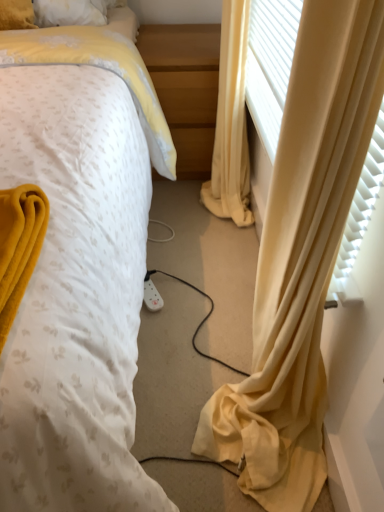
Question: From the image's perspective, does yellow fabric curtain at right appear higher than light wood/finely finished nightstand at center?

Choices:
 (A) no
 (B) yes

Answer: (A)

Question: Is yellow fabric curtain at right positioned in front of light wood/finely finished nightstand at center?

Choices:
 (A) yes
 (B) no

Answer: (A)

Question: Does yellow fabric curtain at right appear on the left side of light wood/finely finished nightstand at center?

Choices:
 (A) no
 (B) yes

Answer: (A)

Question: Is yellow fabric curtain at right behind light wood/finely finished nightstand at center?

Choices:
 (A) no
 (B) yes

Answer: (A)

Question: From a real-world perspective, is yellow fabric curtain at right located higher than light wood/finely finished nightstand at center?

Choices:
 (A) no
 (B) yes

Answer: (B)

Question: Can you confirm if yellow fabric curtain at right is wider than light wood/finely finished nightstand at center?

Choices:
 (A) yes
 (B) no

Answer: (B)

Question: Is white dotted fabric at center to the left of light wood/finely finished nightstand at center from the viewer's perspective?

Choices:
 (A) no
 (B) yes

Answer: (B)

Question: Does white dotted fabric at center turn towards light wood/finely finished nightstand at center?

Choices:
 (A) yes
 (B) no

Answer: (B)

Question: From a real-world perspective, is white dotted fabric at center over light wood/finely finished nightstand at center?

Choices:
 (A) yes
 (B) no

Answer: (A)

Question: Can you confirm if white dotted fabric at center is shorter than light wood/finely finished nightstand at center?

Choices:
 (A) no
 (B) yes

Answer: (A)

Question: Is white dotted fabric at center further to the viewer compared to light wood/finely finished nightstand at center?

Choices:
 (A) yes
 (B) no

Answer: (B)

Question: From a real-world perspective, does white dotted fabric at center sit lower than light wood/finely finished nightstand at center?

Choices:
 (A) yes
 (B) no

Answer: (B)

Question: Are light wood/finely finished nightstand at center and yellow fabric curtain at right far apart?

Choices:
 (A) no
 (B) yes

Answer: (A)